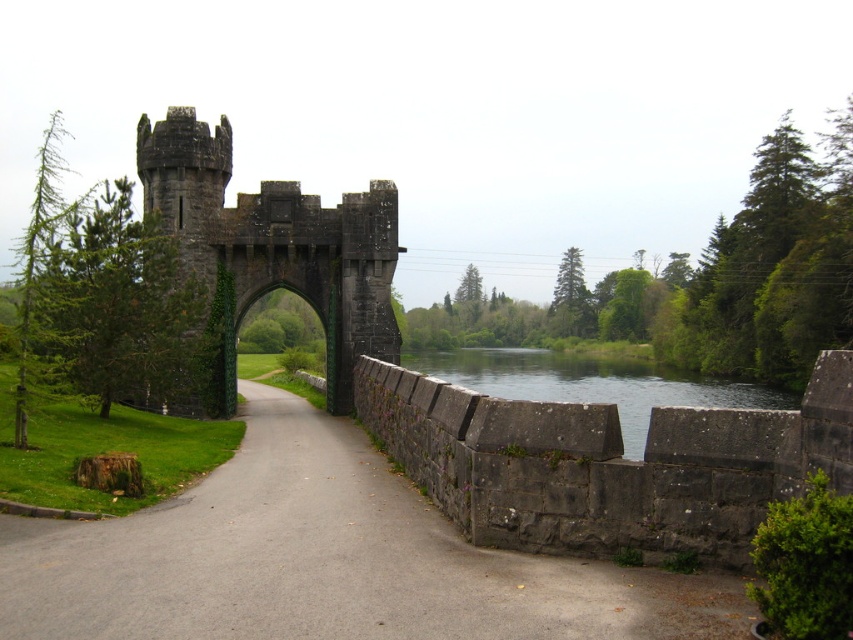
You are standing in front of the stone archway and want to walk towards the point that is closer to you. Which point should you head towards, point (596,618) or point (576,364)?

You should head towards point (596,618) because it is closer to you than point (576,364).

You are standing on the paved pathway in front of the dark gray stone castle at center. You want to cross the clear water at bridge right. Which direction should you walk to reach the bridge?

The dark gray stone castle at center is to the left of clear water at bridge right, so you should walk to the right to reach the bridge.

You are an architect designing a model of the castle and its surroundings. The model must accurately represent the relative sizes of the dark gray stone castle at center and the clear water at bridge right. Which of the two should you allocate more space to in your model?

The clear water at bridge right should be allocated more space in the model since it occupies more space than the dark gray stone castle at center according to the description.